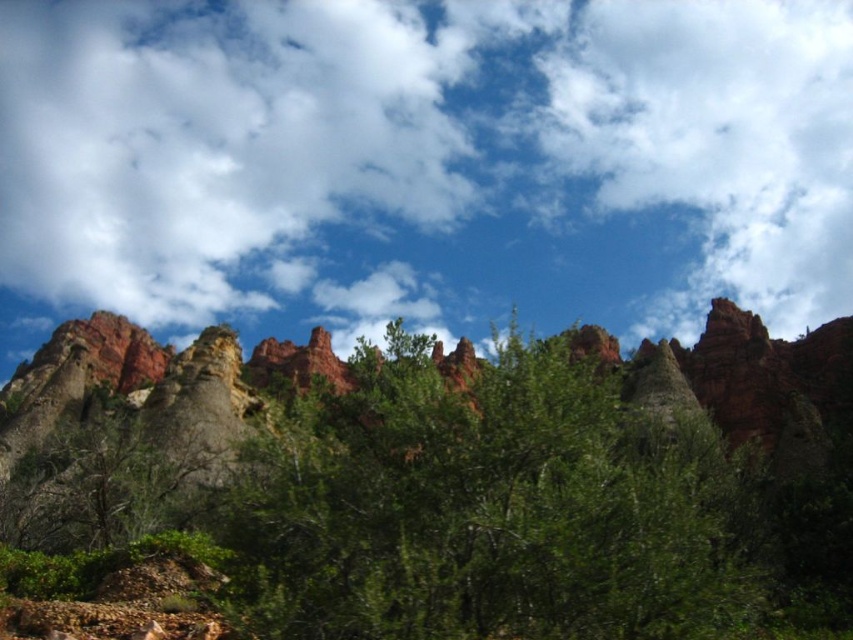
You are a hiker standing at the base of the red rock formations. You notice a white fluffy cloud at upper center and a green leafy tree at center. Which object is higher in the sky?

The white fluffy cloud at upper center is positioned over the green leafy tree at center, so it is higher in the sky.

You are an explorer standing in front of the green leafy tree at center. You look up and see the white fluffy cloud at upper center. In which direction relative to the tree is the cloud located?

The white fluffy cloud at upper center is to the left of the green leafy tree at center.